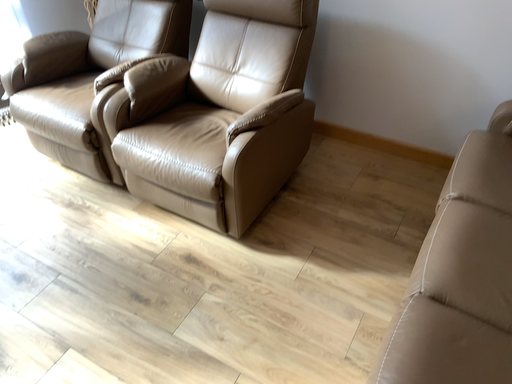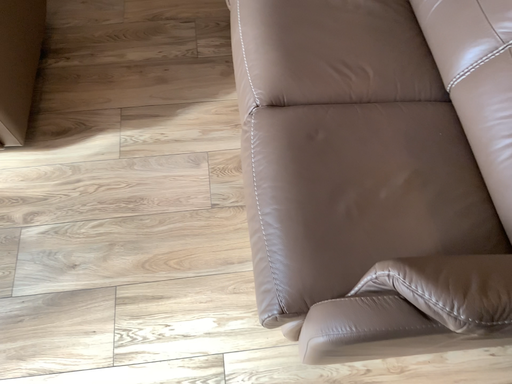
Question: Which way did the camera rotate in the video?

Choices:
 (A) rotated upward
 (B) rotated downward

Answer: (B)